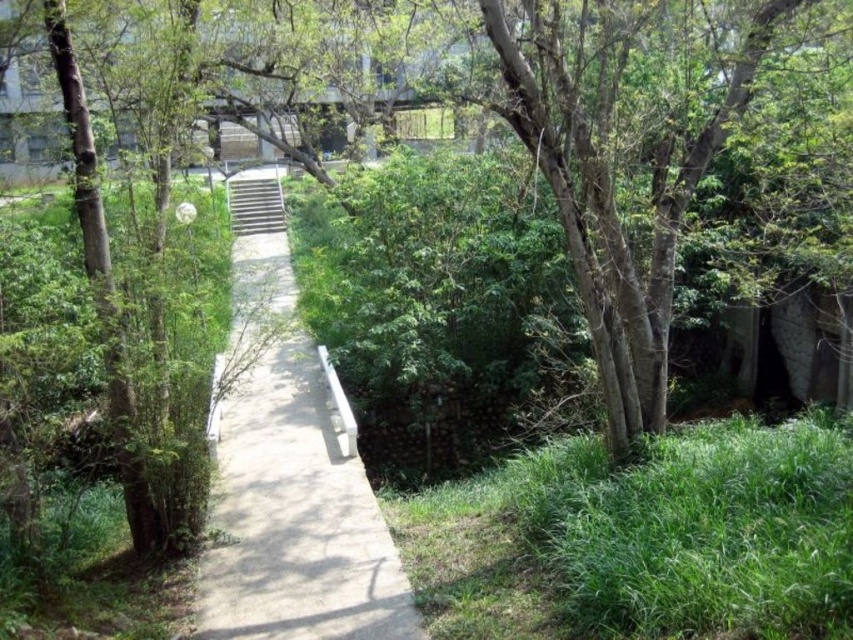
Is concrete at center closer to the viewer compared to metallic gray stairs at center?

That is True.

Who is positioned more to the left, concrete at center or metallic gray stairs at center?

Positioned to the left is metallic gray stairs at center.

At what (x,y) coordinates should I click in order to perform the action: click on concrete at center. Please return your answer as a coordinate pair (x, y). Image resolution: width=853 pixels, height=640 pixels. Looking at the image, I should click on (289, 483).

You are a GUI agent. You are given a task and a screenshot of the screen. Output one action in this format:
    pyautogui.click(x=<x>, y=<y>)
    Task: Click on the concrete at center
    This screenshot has height=640, width=853.
    Given the screenshot: What is the action you would take?
    pyautogui.click(x=289, y=483)